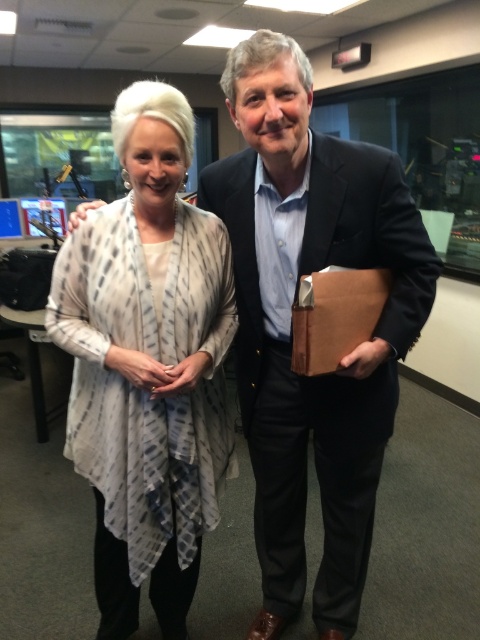
Please provide the 2D coordinates of the matte black suit at center in the image. The coordinates should be in the format of a tuple with two decimal numbers separated by a comma, enclosed in parentheses.

The 2D coordinates of the matte black suit at center are at point (x=290, y=324).